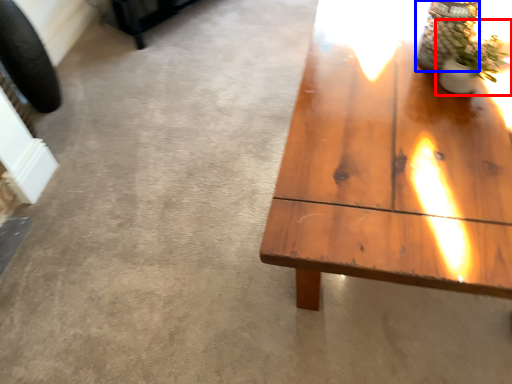
Question: Which of the following is the closest to the observer, houseplant (highlighted by a red box) or glass vase (highlighted by a blue box)?

Choices:
 (A) houseplant
 (B) glass vase

Answer: (A)